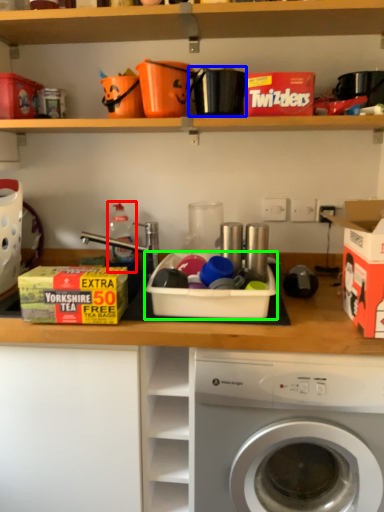
Question: Which object is positioned farthest from bottle (highlighted by a red box)? Select from appliance (highlighted by a blue box) and storage box (highlighted by a green box).

Choices:
 (A) appliance
 (B) storage box

Answer: (A)